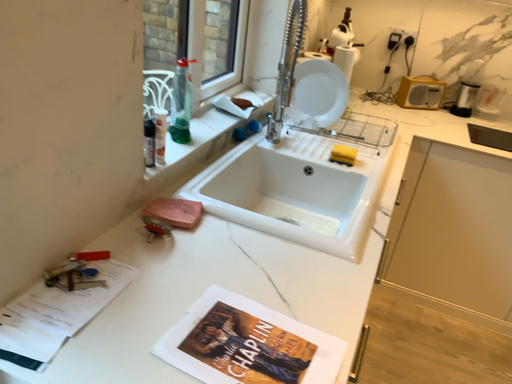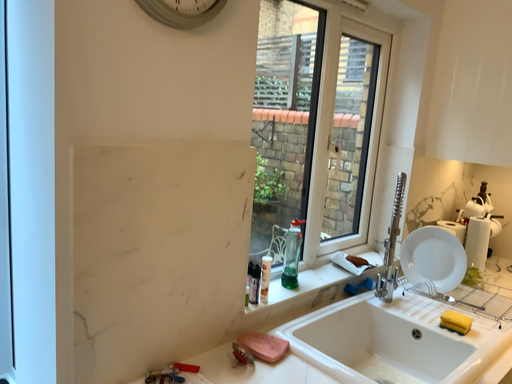
Question: How did the camera likely rotate when shooting the video?

Choices:
 (A) rotated right
 (B) rotated left

Answer: (B)